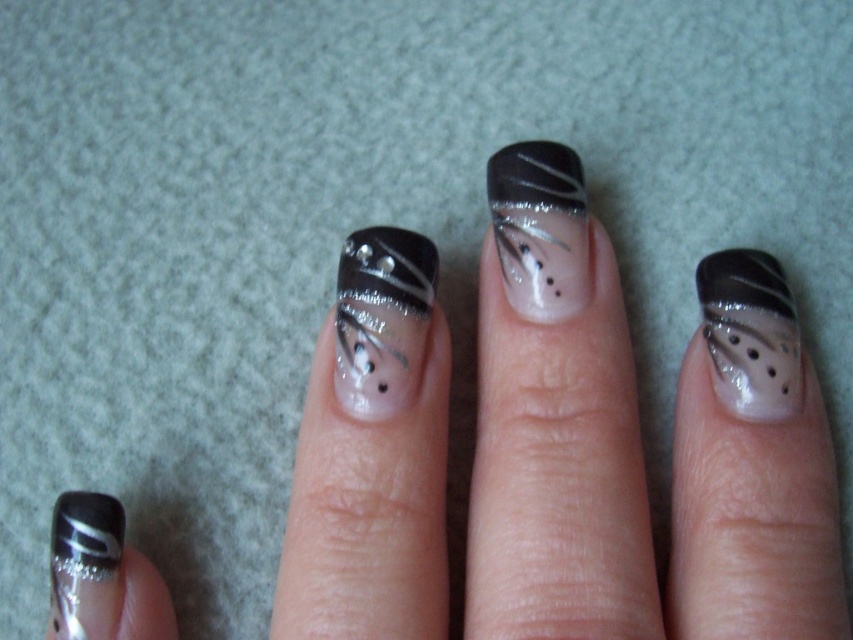
Looking at this image, is the position of satin black nail at center less distant than that of matte silver nail at lower left?

No, it is not.

Who is taller, satin black nail at center or matte silver nail at lower left?

satin black nail at center is taller.

Where is `satin black nail at center`? The height and width of the screenshot is (640, 853). satin black nail at center is located at coordinates (381, 317).

The width and height of the screenshot is (853, 640). I want to click on satin black nail at center, so click(x=381, y=317).

Is satin silver nail at center shorter than matte silver nail at lower left?

In fact, satin silver nail at center may be taller than matte silver nail at lower left.

Who is more distant from viewer, (x=737, y=257) or (x=123, y=525)?

The point (x=737, y=257) is behind.

Where is `satin silver nail at center`? This screenshot has width=853, height=640. satin silver nail at center is located at coordinates coord(750,333).

Does matte black nail art at center appear on the right side of satin silver nail at center?

In fact, matte black nail art at center is to the left of satin silver nail at center.

In the scene shown: Can you confirm if matte black nail art at center is smaller than satin silver nail at center?

Yes, matte black nail art at center is smaller than satin silver nail at center.

Does point (538, 248) lie behind point (734, 396)?

Yes, it is behind point (734, 396).

The width and height of the screenshot is (853, 640). Find the location of `matte black nail art at center`. matte black nail art at center is located at coordinates (540, 227).